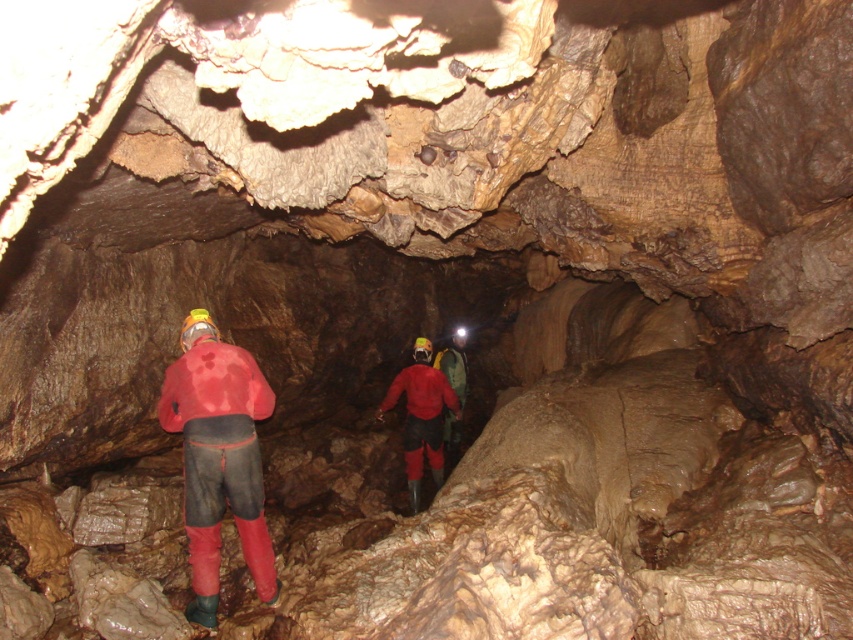
Between matte red jacket at center and red rubber boots at center, which one appears on the right side from the viewer's perspective?

red rubber boots at center

Is point (433, 396) closer to camera compared to point (453, 376)?

Yes, it is in front of point (453, 376).

At what (x,y) coordinates should I click in order to perform the action: click on matte red jacket at center. Please return your answer as a coordinate pair (x, y). Image resolution: width=853 pixels, height=640 pixels. Looking at the image, I should click on (421, 417).

Which is in front, point (209, 346) or point (415, 339)?

Point (209, 346) is in front.

Does rubberized red suit at center have a lesser height compared to matte red jacket at center?

In fact, rubberized red suit at center may be taller than matte red jacket at center.

In order to click on rubberized red suit at center in this screenshot , I will do `click(218, 456)`.

Looking at this image, does rubberized red suit at center appear over red rubber boots at center?

Indeed, rubberized red suit at center is positioned over red rubber boots at center.

Between rubberized red suit at center and red rubber boots at center, which one is positioned lower?

red rubber boots at center

This screenshot has height=640, width=853. What are the coordinates of `rubberized red suit at center` in the screenshot? It's located at (218, 456).

You are a GUI agent. You are given a task and a screenshot of the screen. Output one action in this format:
    pyautogui.click(x=<x>, y=<y>)
    Task: Click on the rubberized red suit at center
    
    Given the screenshot: What is the action you would take?
    pyautogui.click(x=218, y=456)